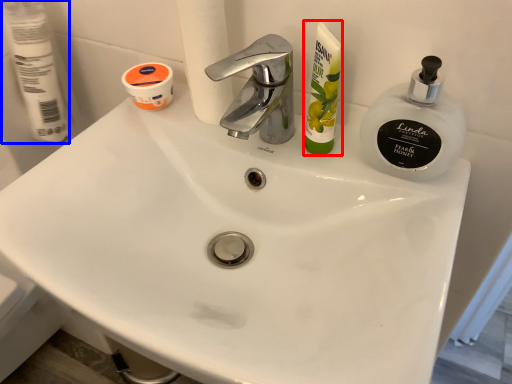
Question: Which point is further to the camera, toiletry (highlighted by a red box) or toilet paper (highlighted by a blue box)?

Choices:
 (A) toiletry
 (B) toilet paper

Answer: (B)